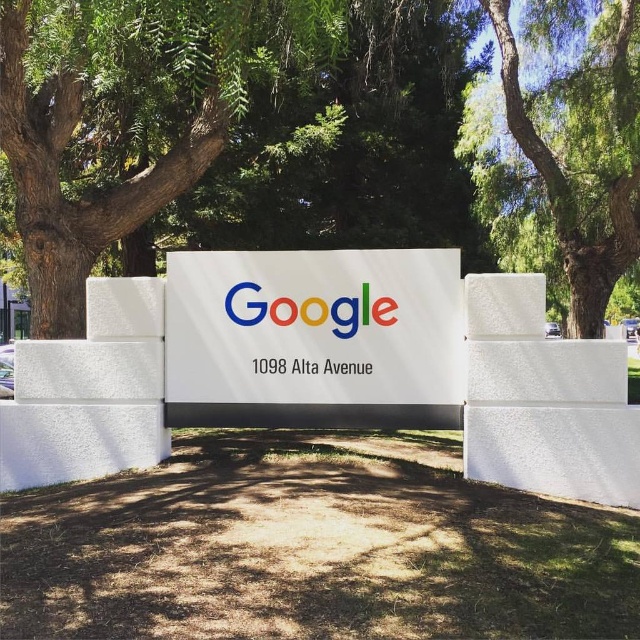
Which is in front, point (54, 212) or point (336, 314)?

Point (336, 314) is in front.

Looking at this image, can you confirm if green leafy tree at center is positioned below multicolored plastic google sign at center?

No.

Is point (42, 186) in front of point (308, 321)?

No, it is not.

This screenshot has width=640, height=640. In order to click on green leafy tree at center in this screenshot , I will do `click(129, 113)`.

Which is in front, point (182, 349) or point (604, 35)?

Point (182, 349) is in front.

Is white glossy sign at center behind green leafy tree at upper center?

No, white glossy sign at center is in front of green leafy tree at upper center.

Who is more distant from viewer, (234, 262) or (477, 138)?

The point (477, 138) is behind.

Find the location of a particular element. white glossy sign at center is located at coordinates point(314,339).

Does green leafy tree at upper center have a larger size compared to multicolored plastic google sign at center?

Correct, green leafy tree at upper center is larger in size than multicolored plastic google sign at center.

Does green leafy tree at upper center appear on the left side of multicolored plastic google sign at center?

In fact, green leafy tree at upper center is to the right of multicolored plastic google sign at center.

Who is more forward, (x=595, y=321) or (x=328, y=314)?

Positioned in front is point (x=328, y=314).

This screenshot has height=640, width=640. In order to click on green leafy tree at upper center in this screenshot , I will do `click(561, 145)`.